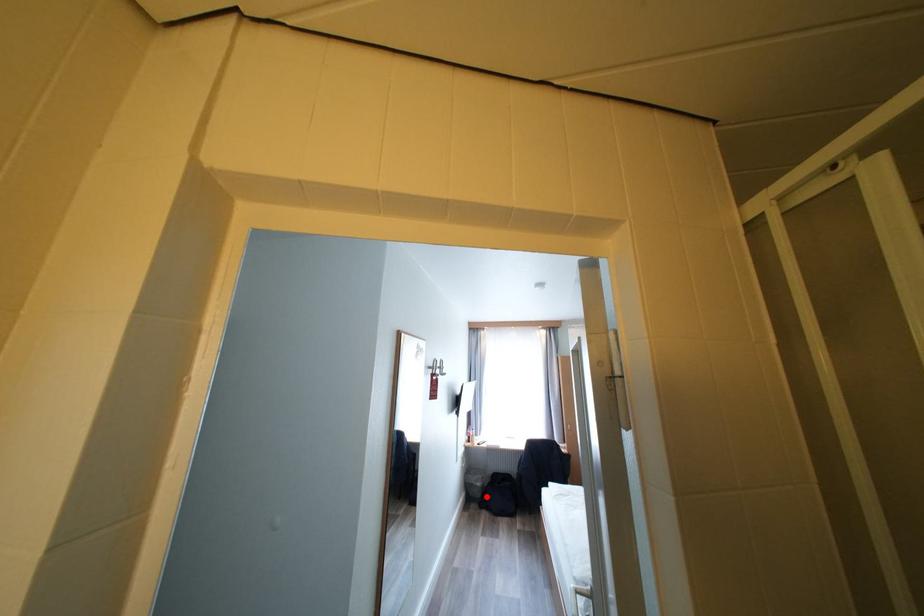
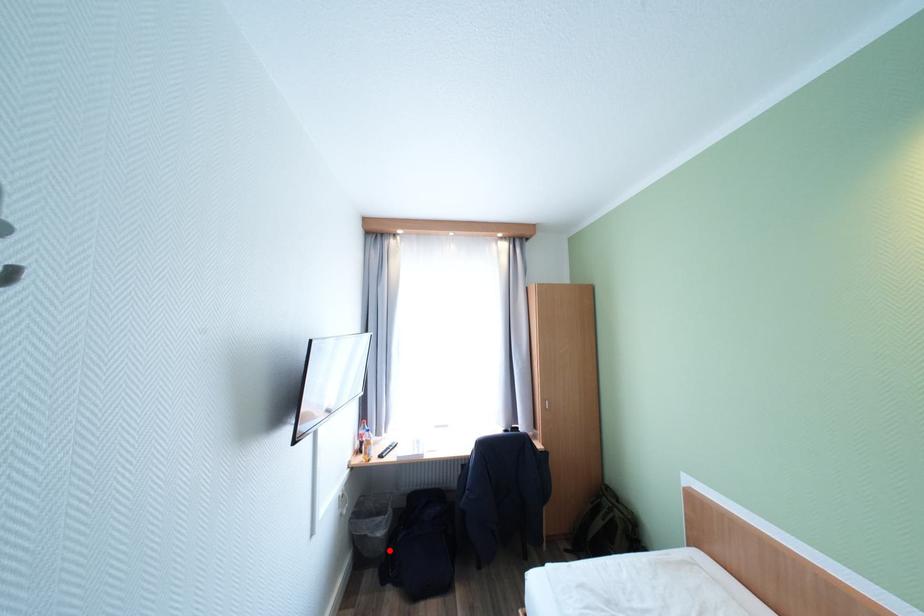
I am providing you with two images of the same scene from different viewpoints. A red point is marked on the first image and another point is marked on the second image. Are the points marked in image1 and image2 representing the same 3D position?

Yes